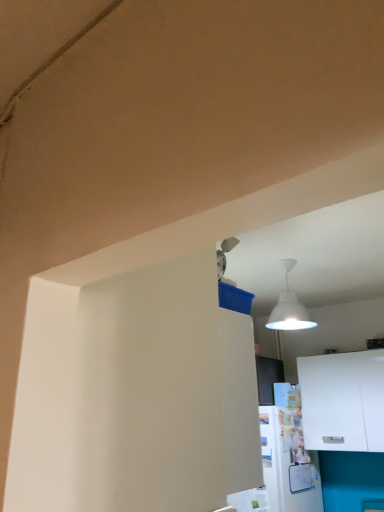
Question: Should I look upward or downward to see white matte cabinet at lower right?

Choices:
 (A) down
 (B) up

Answer: (A)

Question: Is white matte cabinet at lower right completely or partially inside white glossy refrigerator at lower right?

Choices:
 (A) yes
 (B) no

Answer: (B)

Question: Can you confirm if white glossy refrigerator at lower right is bigger than white matte cabinet at lower right?

Choices:
 (A) no
 (B) yes

Answer: (B)

Question: Is white glossy refrigerator at lower right positioned beyond the bounds of white matte cabinet at lower right?

Choices:
 (A) yes
 (B) no

Answer: (A)

Question: From the image's perspective, would you say white glossy refrigerator at lower right is shown under white matte cabinet at lower right?

Choices:
 (A) yes
 (B) no

Answer: (A)

Question: From the image's perspective, does white glossy refrigerator at lower right appear higher than white matte cabinet at lower right?

Choices:
 (A) no
 (B) yes

Answer: (A)

Question: Is white glossy refrigerator at lower right shorter than white matte cabinet at lower right?

Choices:
 (A) yes
 (B) no

Answer: (B)

Question: Is white matte cabinet at lower right to the right of white glossy refrigerator at lower right from the viewer's perspective?

Choices:
 (A) no
 (B) yes

Answer: (B)

Question: Does white matte cabinet at lower right have a lesser height compared to white glossy refrigerator at lower right?

Choices:
 (A) yes
 (B) no

Answer: (A)

Question: From the image's perspective, would you say white matte cabinet at lower right is shown under white glossy refrigerator at lower right?

Choices:
 (A) yes
 (B) no

Answer: (B)

Question: Is white matte cabinet at lower right positioned beyond the bounds of white glossy refrigerator at lower right?

Choices:
 (A) no
 (B) yes

Answer: (B)

Question: Is white matte cabinet at lower right at the left side of white glossy refrigerator at lower right?

Choices:
 (A) no
 (B) yes

Answer: (A)

Question: Does white matte cabinet at lower right lie behind white glossy refrigerator at lower right?

Choices:
 (A) yes
 (B) no

Answer: (A)

Question: Based on their positions, is white matte cabinet at lower right located to the left or right of white glossy refrigerator at lower right?

Choices:
 (A) right
 (B) left

Answer: (A)